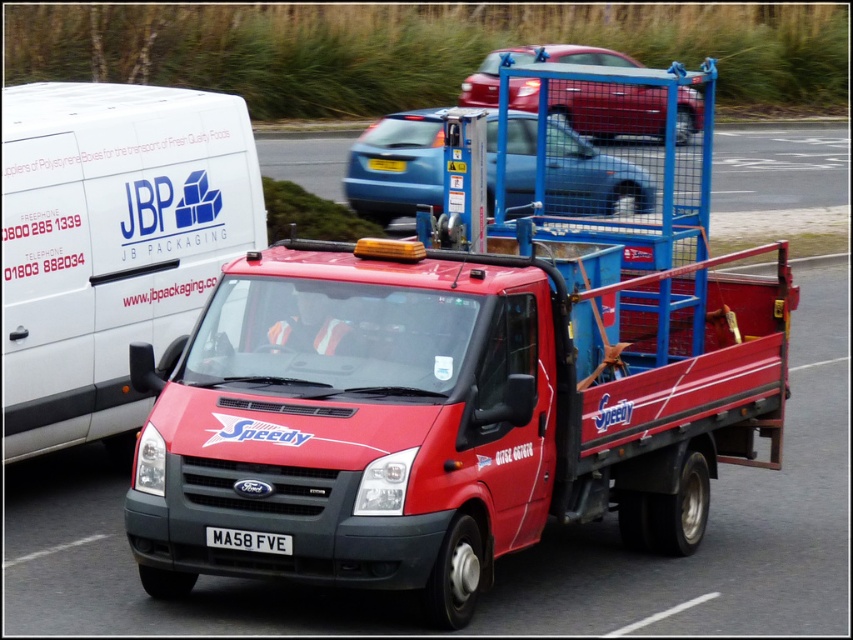
From the picture: Does metallic red car at center appear under white plastic license plate at center?

No.

Who is more distant from viewer, (643, 102) or (247, 541)?

Point (643, 102)

Identify the location of metallic red car at center. Image resolution: width=853 pixels, height=640 pixels. (608, 108).

The image size is (853, 640). Identify the location of metallic red car at center. (608, 108).

Does white matte van at left appear over metallic red car at center?

Actually, white matte van at left is below metallic red car at center.

Who is taller, white matte van at left or metallic red car at center?

Result: metallic red car at center is taller.

Between point (4, 257) and point (616, 92), which one is positioned in front?

Point (4, 257) is in front.

Where is `white matte van at left`? The image size is (853, 640). white matte van at left is located at coordinates (111, 244).

The height and width of the screenshot is (640, 853). Describe the element at coordinates (444, 412) in the screenshot. I see `red matte truck at center` at that location.

Which is more to the right, red matte truck at center or white matte van at left?

red matte truck at center is more to the right.

Find the location of `red matte truck at center`. red matte truck at center is located at coordinates (444, 412).